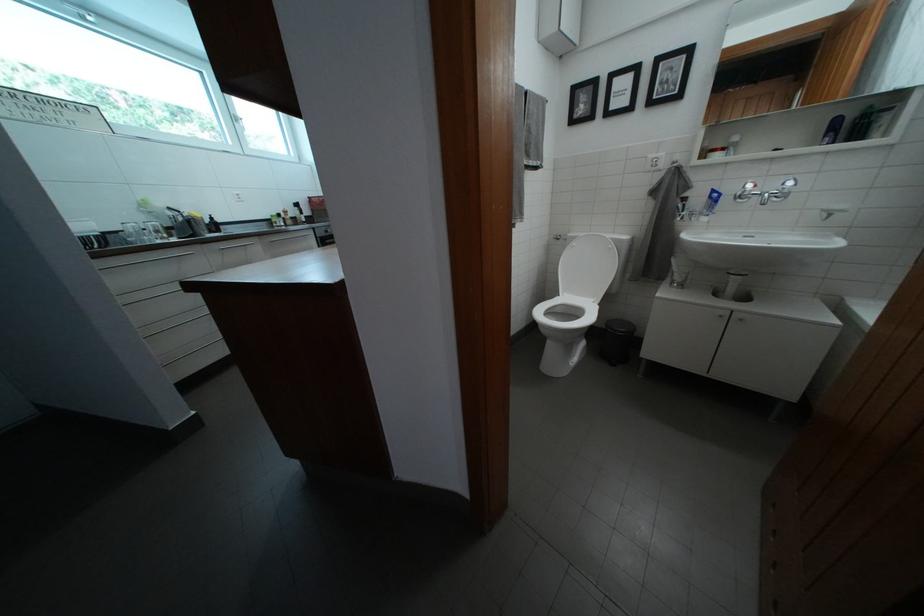
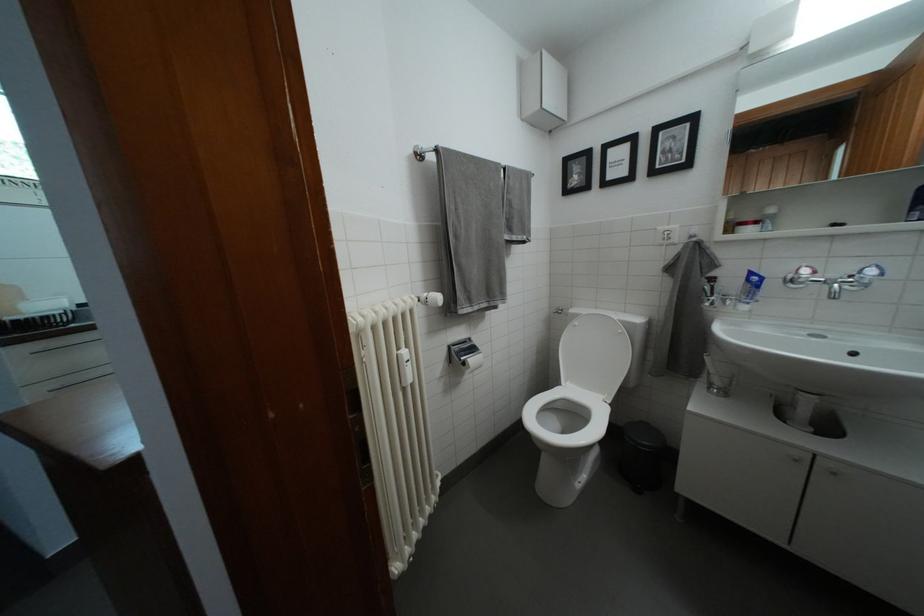
Question: The images are taken continuously from a first-person perspective. In which direction is your viewpoint rotating?

Choices:
 (A) Left
 (B) Right
 (C) Up
 (D) Down

Answer: (C)